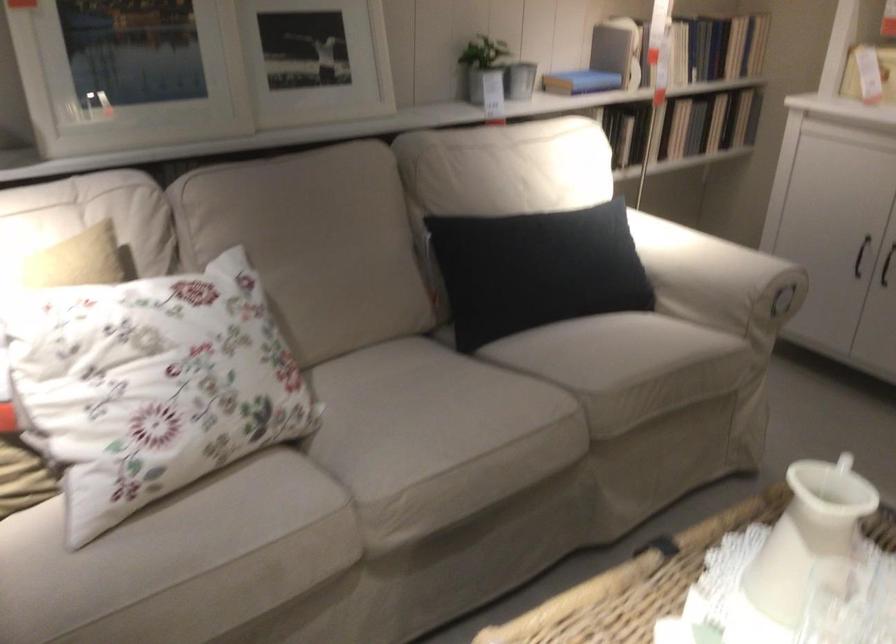
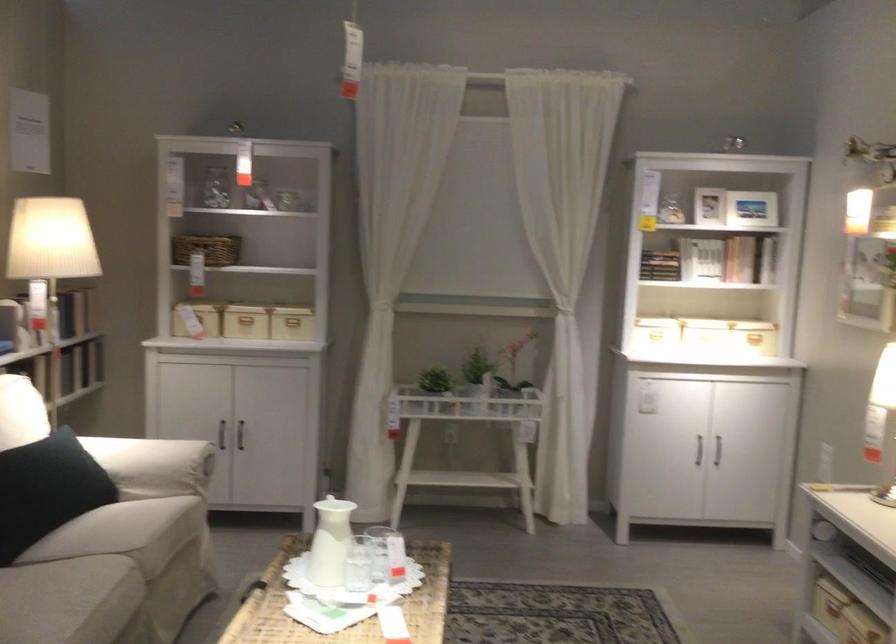
Find the pixel in the second image that matches the point at 530,412 in the first image.

(110, 576)